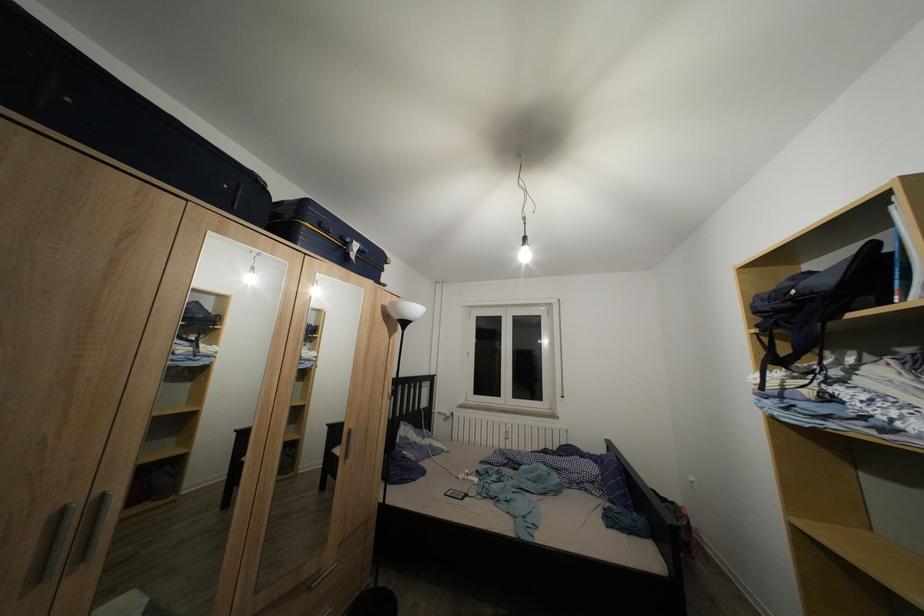
The height and width of the screenshot is (616, 924). Find the location of `white window handle`. white window handle is located at coordinates (506, 361).